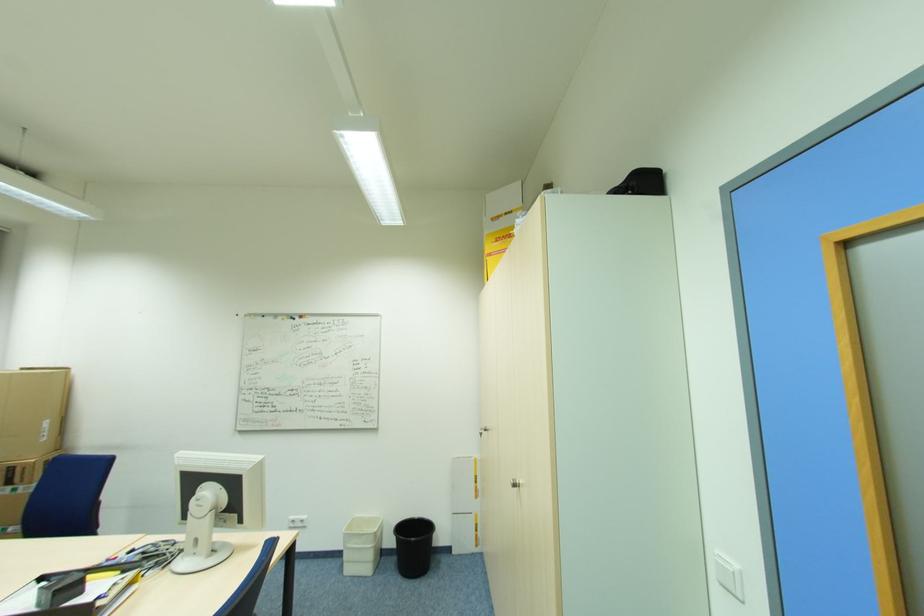
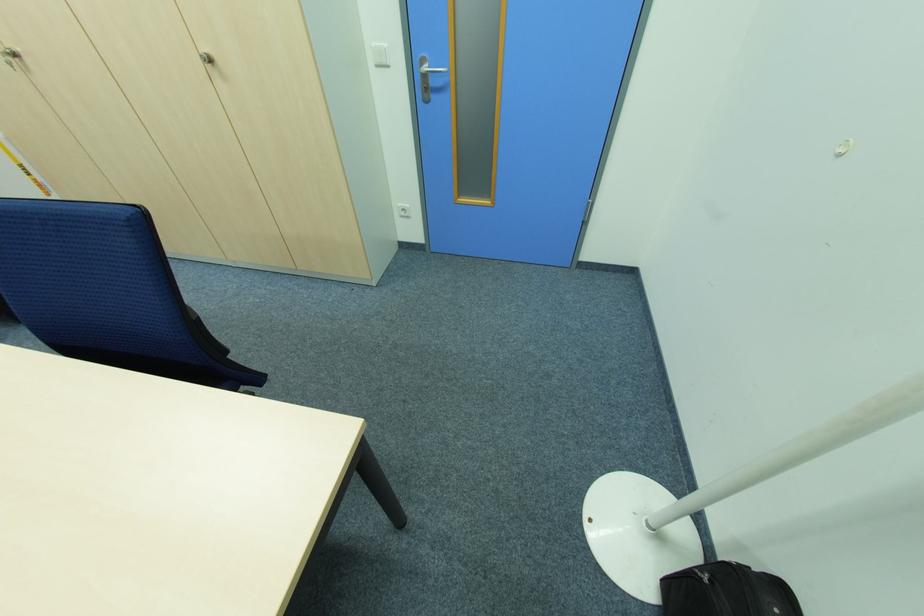
The point at (483, 434) is marked in the first image. Where is the corresponding point in the second image?

(14, 65)